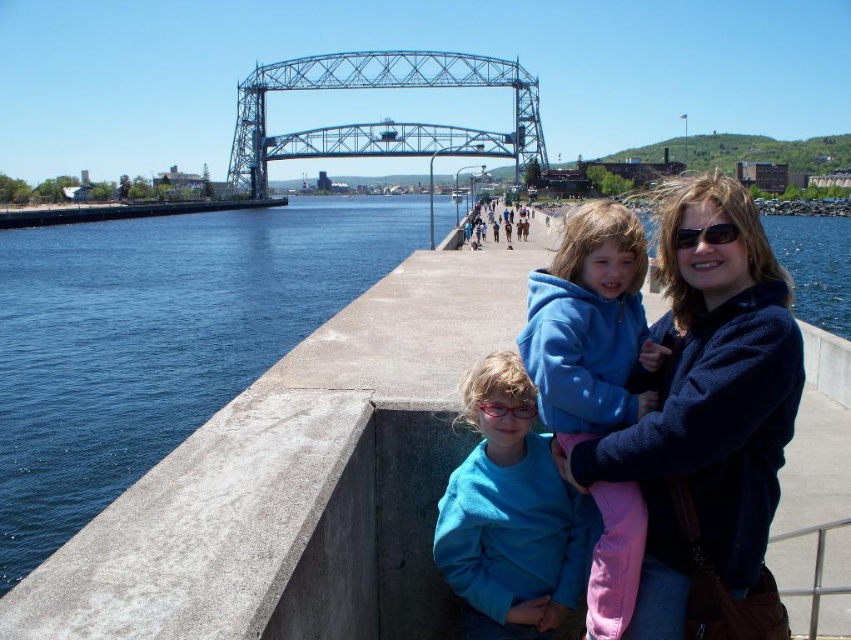
Is point (509, 561) positioned in front of point (772, 538)?

Yes, point (509, 561) is closer to viewer.

Can you confirm if matte blue sweater at center is shorter than silver metallic rail at lower right?

In fact, matte blue sweater at center may be taller than silver metallic rail at lower right.

Identify the location of matte blue sweater at center. (510, 515).

The width and height of the screenshot is (851, 640). What are the coordinates of `matte blue sweater at center` in the screenshot? It's located at (510, 515).

Looking at this image, who is positioned more to the right, blue fleece jacket at center or matte blue sweater at center?

blue fleece jacket at center

Looking at this image, who is more distant from viewer, (584, 280) or (461, 595)?

The point (584, 280) is more distant.

Which is behind, point (537, 380) or point (492, 544)?

Positioned behind is point (537, 380).

This screenshot has height=640, width=851. Find the location of `blue fleece jacket at center`. blue fleece jacket at center is located at coordinates (589, 324).

Between blue concrete water at left and sunglasses at center, which one has more height?

blue concrete water at left is taller.

Looking at this image, does blue concrete water at left have a larger size compared to sunglasses at center?

Indeed, blue concrete water at left has a larger size compared to sunglasses at center.

Is point (260, 266) less distant than point (701, 234)?

No, it is not.

You are a GUI agent. You are given a task and a screenshot of the screen. Output one action in this format:
    pyautogui.click(x=<x>, y=<y>)
    Task: Click on the blue concrete water at left
    This screenshot has height=640, width=851.
    Given the screenshot: What is the action you would take?
    pyautogui.click(x=157, y=339)